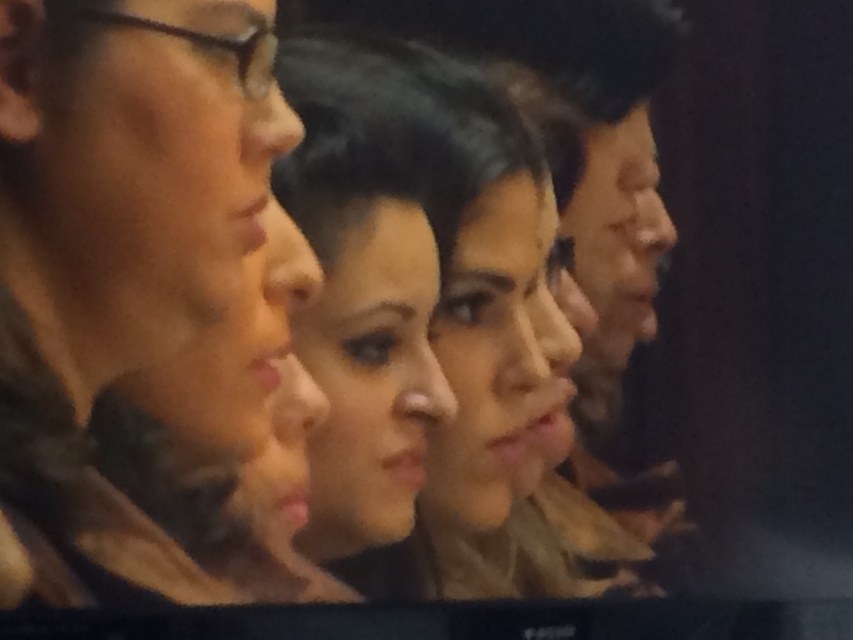
Question: Which of the following is the farthest from the observer?

Choices:
 (A) matte brown hair at center
 (B) smooth brown hair at center

Answer: (B)

Question: Is matte brown hair at center to the right of smooth brown hair at center from the viewer's perspective?

Choices:
 (A) no
 (B) yes

Answer: (A)

Question: Can you confirm if matte brown hair at center is positioned above smooth brown hair at center?

Choices:
 (A) no
 (B) yes

Answer: (B)

Question: Among these points, which one is farthest from the camera?

Choices:
 (A) (453, 122)
 (B) (86, 314)

Answer: (A)

Question: Does matte brown hair at center appear on the right side of smooth brown hair at center?

Choices:
 (A) no
 (B) yes

Answer: (A)

Question: Which object is closer to the camera taking this photo?

Choices:
 (A) smooth brown hair at center
 (B) matte brown hair at center

Answer: (B)